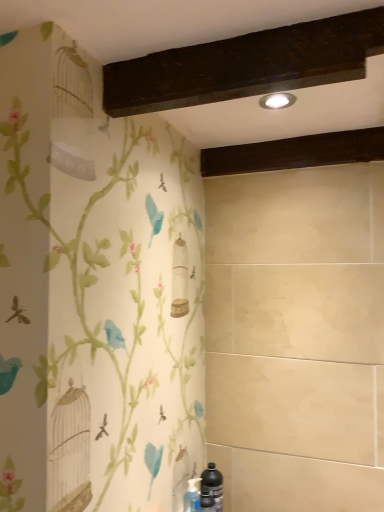
Question: In the image, is matte silver light fixture at upper center on the left side or the right side of black matte bottle at lower right?

Choices:
 (A) left
 (B) right

Answer: (B)

Question: Is matte silver light fixture at upper center inside or outside of black matte bottle at lower right?

Choices:
 (A) inside
 (B) outside

Answer: (B)

Question: Which object is the closest to the dark wood beam at upper center?

Choices:
 (A) matte silver light fixture at upper center
 (B) black matte bottle at lower right

Answer: (A)

Question: Which object is positioned farthest from the black matte bottle at lower right?

Choices:
 (A) dark wood beam at upper center
 (B) matte silver light fixture at upper center

Answer: (B)